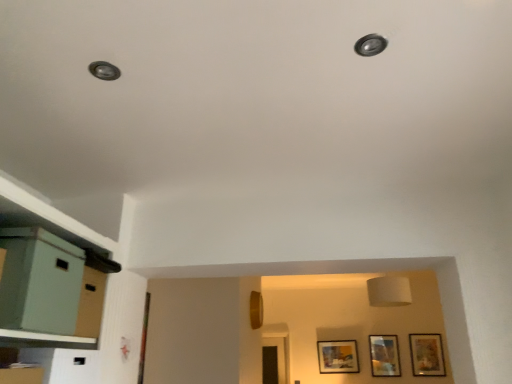
Question: Considering the positions of matte wooden picture frame at center, marked as the 1th picture frame in a left-to-right arrangement, and matte gold picture frame at lower right, the first picture frame in the right-to-left sequence, in the image, is matte wooden picture frame at center, marked as the 1th picture frame in a left-to-right arrangement, wider or thinner than matte gold picture frame at lower right, the first picture frame in the right-to-left sequence,?

Choices:
 (A) thin
 (B) wide

Answer: (B)

Question: In the image, is matte wooden picture frame at center, marked as the 1th picture frame in a left-to-right arrangement, on the left side or the right side of matte gold picture frame at lower right, the first picture frame in the right-to-left sequence?

Choices:
 (A) left
 (B) right

Answer: (A)

Question: Which object is positioned closest to the wooden picture frame at lower right, the 2th picture frame in the right-to-left sequence?

Choices:
 (A) matte green file cabinet at left
 (B) matte gold picture frame at lower right, acting as the 3th picture frame starting from the left
 (C) matte wooden picture frame at center, which appears as the third picture frame when viewed from the right

Answer: (B)

Question: Which object is positioned farthest from the matte green file cabinet at left?

Choices:
 (A) matte gold picture frame at lower right, acting as the 3th picture frame starting from the left
 (B) matte wooden picture frame at center, which appears as the third picture frame when viewed from the right
 (C) wooden picture frame at lower right, the second picture frame in the left-to-right sequence

Answer: (A)